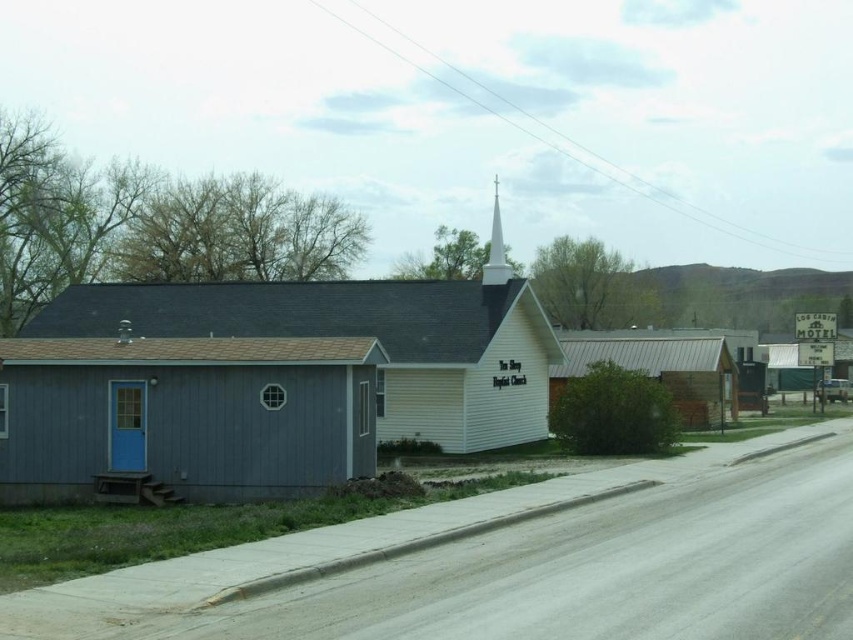
You are standing at the center of the image and want to go to the matte blue cabin at left. In which direction should you move?

Since the matte blue cabin at left is located at point 0.652 on the x axis and 0.217 on the y axis, you should move to the left and slightly downward to reach it.

You are standing in front of the church and notice two features on the building. The first is the matte blue siding at center and the second is the white smooth steeple at upper center. Which of these two features is positioned higher up on the building?

The white smooth steeple at upper center is positioned higher up on the building than the matte blue siding at center.

You are standing in the middle of the rural scene and notice two buildings in front of you. The first is the matte blue siding at center and the second is the brown wood cabin at center. Which building takes up more area in the scene?

The brown wood cabin at center occupies more space than the matte blue siding at center, so it takes up more area in the scene.